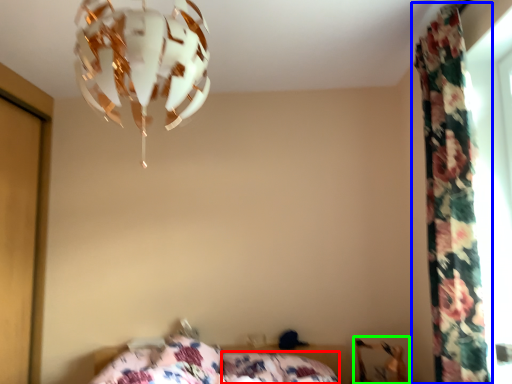
Question: Which is nearer to the pillow (highlighted by a red box)? curtain (highlighted by a blue box) or swivel chair (highlighted by a green box).

Choices:
 (A) curtain
 (B) swivel chair

Answer: (B)